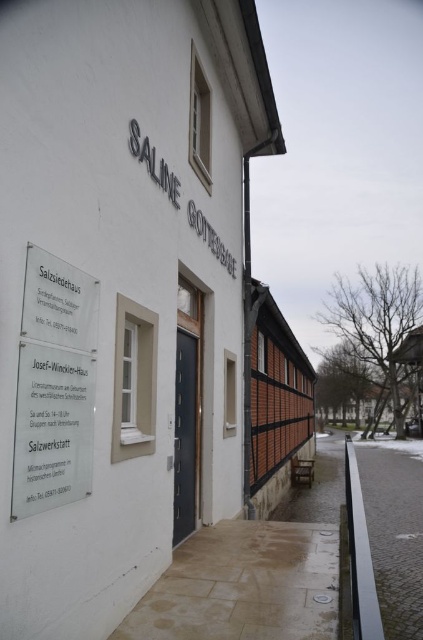
Question: Is transparent glass sign at center to the left of metallic gray door at center from the viewer's perspective?

Choices:
 (A) no
 (B) yes

Answer: (B)

Question: Is transparent glass sign at center to the left of metallic gray door at center from the viewer's perspective?

Choices:
 (A) no
 (B) yes

Answer: (B)

Question: Is transparent glass sign at center smaller than metallic gray door at center?

Choices:
 (A) yes
 (B) no

Answer: (A)